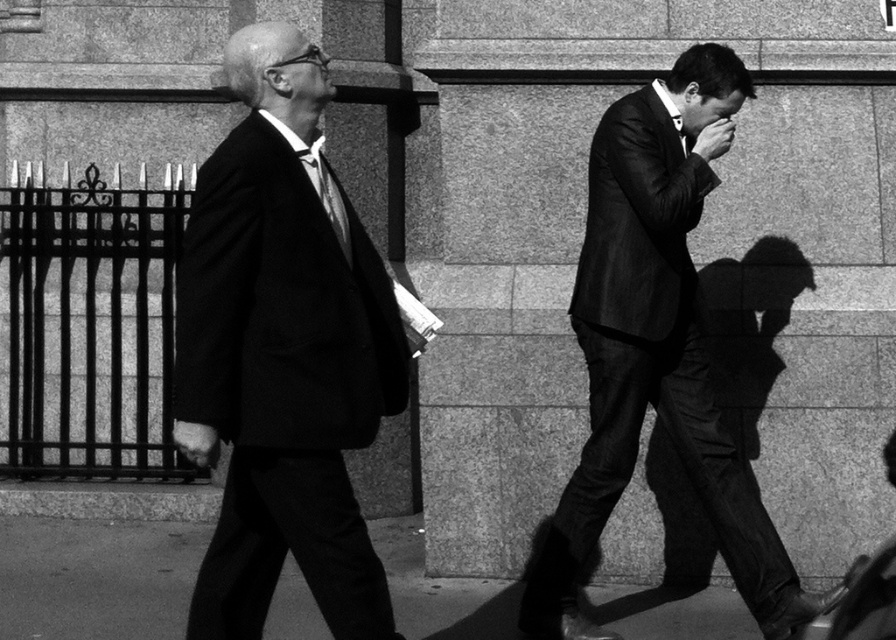
You are standing at a point 20 feet away from the camera. You want to walk towards the camera until you reach the point labeled as point (309, 49). Will you have to walk forward or backward to reach that point?

The distance of point (309, 49) from camera is 19.53 feet, so you are currently 20 feet away from the camera. To reach point (309, 49), you need to walk forward by approximately 0.47 feet because the point is closer to the camera than your current position.

In the scene shown: You are a pedestrian trying to cross the street where these two people are walking. You want to know which of the two points, point (x=287, y=176) or point (x=688, y=381), is closer to the sidewalk entrance. Based on their positions, which point is in front?

Point (x=287, y=176) is in front of point (x=688, y=381), so it is closer to the sidewalk entrance.

You are a photographer analyzing the composition of this black and white photo. You notice the matte black suit at left and the smooth concrete pavement at lower center. Which object appears bigger in the image?

The matte black suit at left appears bigger in the image compared to the smooth concrete pavement at lower center as stated in the objects description.